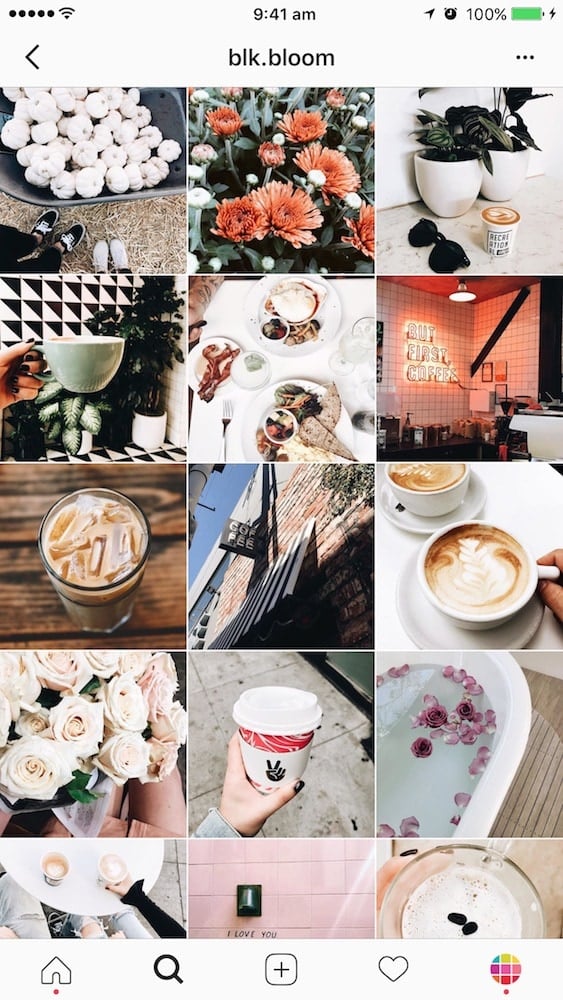
At what (x,y) coordinates should I click in order to perform the action: click on coffee cups. Please return your answer as a coordinate pair (x, y). Image resolution: width=563 pixels, height=1000 pixels. Looking at the image, I should click on (92, 355), (419, 476), (497, 233), (485, 574), (435, 480), (111, 597), (272, 709).